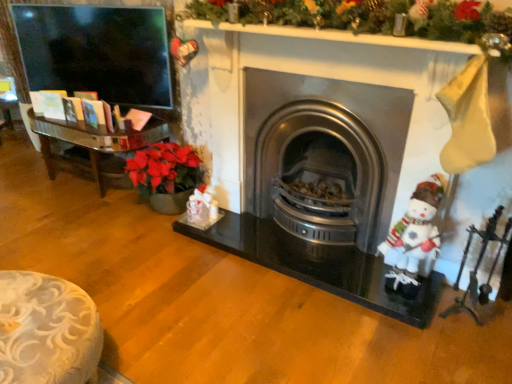
I want to click on free region on the left part of stainless steel wood burning stove at center, so click(x=199, y=266).